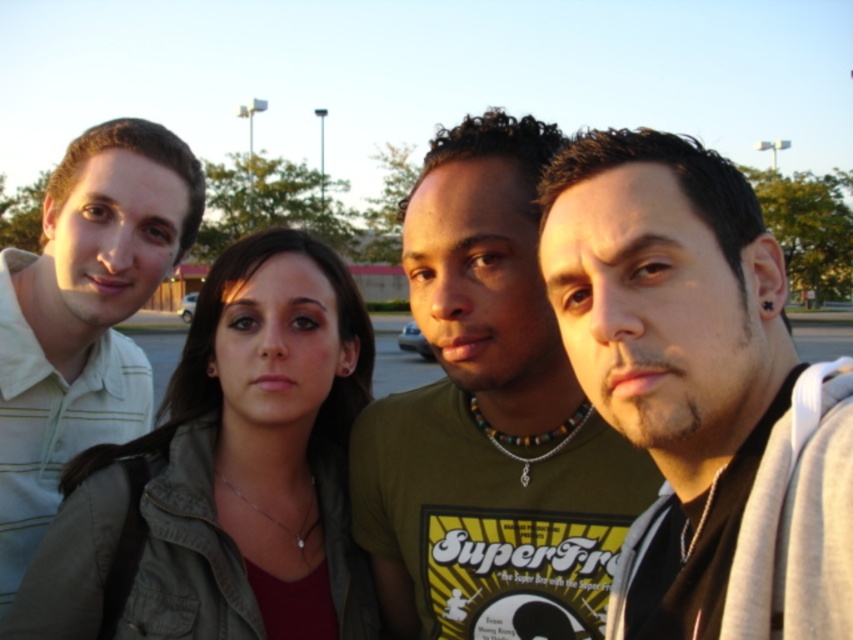
Looking at this image, who is lower down, green t-shirt at center or matte olive green jacket at center?

matte olive green jacket at center is below.

Is green t-shirt at center wider than matte olive green jacket at center?

Incorrect, green t-shirt at center's width does not surpass matte olive green jacket at center's.

The width and height of the screenshot is (853, 640). Describe the element at coordinates (489, 419) in the screenshot. I see `green t-shirt at center` at that location.

Identify the location of green t-shirt at center. (489, 419).

Is the position of green t-shirt at center more distant than that of light green striped shirt at left?

No, it is in front of light green striped shirt at left.

Which is behind, point (465, 545) or point (7, 348)?

The point (7, 348) is behind.

Where is `green t-shirt at center`? The width and height of the screenshot is (853, 640). green t-shirt at center is located at coordinates coord(489,419).

Does matte black shirt at center have a larger size compared to green t-shirt at center?

Actually, matte black shirt at center might be smaller than green t-shirt at center.

Between matte black shirt at center and green t-shirt at center, which one is positioned higher?

green t-shirt at center is higher up.

Who is more forward, (850, 456) or (486, 168)?

Point (850, 456) is in front.

This screenshot has height=640, width=853. Find the location of `matte black shirt at center`. matte black shirt at center is located at coordinates (701, 392).